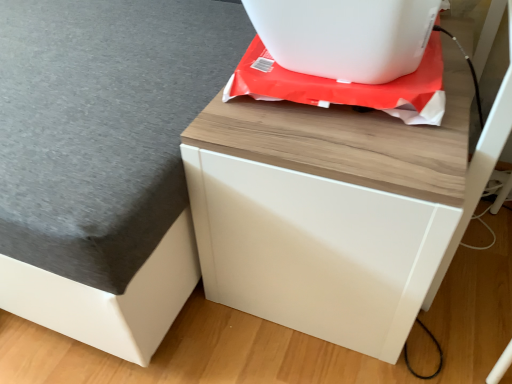
This screenshot has height=384, width=512. What do you see at coordinates (336, 210) in the screenshot? I see `white matte drawer at center` at bounding box center [336, 210].

Find the location of `white matte drawer at center`. white matte drawer at center is located at coordinates (336, 210).

The width and height of the screenshot is (512, 384). What do you see at coordinates (345, 36) in the screenshot? I see `white plastic appliance at upper center` at bounding box center [345, 36].

This screenshot has height=384, width=512. Identify the location of wooden table at upper right. (104, 161).

At what (x,y) coordinates should I click in order to perform the action: click on white matte drawer at center. Please return your answer as a coordinate pair (x, y). The height and width of the screenshot is (384, 512). Looking at the image, I should click on (336, 210).

Identify the location of appliance that appears on the right of wooden table at upper right. This screenshot has width=512, height=384. (345, 36).

In the scene shown: In the image, is white plastic appliance at upper center on the left side or the right side of wooden table at upper right?

From the image, it's evident that white plastic appliance at upper center is to the right of wooden table at upper right.

Is point (318, 2) positioned behind point (156, 330)?

No, (318, 2) is in front of (156, 330).

From the image's perspective, is white plastic appliance at upper center on top of wooden table at upper right?

Yes, from the image's perspective, white plastic appliance at upper center is on top of wooden table at upper right.

Is wooden table at upper right at the right side of white matte drawer at center?

No, wooden table at upper right is not to the right of white matte drawer at center.

From the image's perspective, relative to white matte drawer at center, is wooden table at upper right above or below?

From the image's perspective, wooden table at upper right appears above white matte drawer at center.

Is wooden table at upper right facing away from white matte drawer at center?

No, wooden table at upper right is not facing away from white matte drawer at center.

Where is `furniture on the right of the white plastic appliance at upper center`? This screenshot has width=512, height=384. furniture on the right of the white plastic appliance at upper center is located at coordinates (336, 210).

From the image's perspective, which one is positioned higher, white plastic appliance at upper center or white matte drawer at center?

white plastic appliance at upper center is shown above in the image.

Is white plastic appliance at upper center directly adjacent to white matte drawer at center?

white plastic appliance at upper center and white matte drawer at center are clearly separated.

From the image's perspective, is white matte drawer at center above or below white plastic appliance at upper center?

Based on their image positions, white matte drawer at center is located beneath white plastic appliance at upper center.

Based on the photo, from a real-world perspective, is white matte drawer at center positioned above or below white plastic appliance at upper center?

Clearly, from a real-world perspective, white matte drawer at center is below white plastic appliance at upper center.

Are white matte drawer at center and white plastic appliance at upper center far apart?

No, white matte drawer at center is not far from white plastic appliance at upper center.

Based on the photo, from a real-world perspective, is white matte drawer at center physically below wooden table at upper right?

Indeed, from a real-world perspective, white matte drawer at center is positioned beneath wooden table at upper right.

Is white matte drawer at center oriented towards wooden table at upper right?

No, white matte drawer at center is not facing towards wooden table at upper right.

From the image's perspective, is white matte drawer at center located beneath wooden table at upper right?

Correct, white matte drawer at center appears lower than wooden table at upper right in the image.

The image size is (512, 384). In order to click on table top that is on the left side of white plastic appliance at upper center in this screenshot , I will do `click(104, 161)`.

Can you confirm if wooden table at upper right is taller than white plastic appliance at upper center?

Yes.

From the picture: Is wooden table at upper right positioned behind white plastic appliance at upper center?

No, wooden table at upper right is in front of white plastic appliance at upper center.

You are a GUI agent. You are given a task and a screenshot of the screen. Output one action in this format:
    pyautogui.click(x=<x>, y=<y>)
    Task: Click on the table top lying below the white plastic appliance at upper center (from the image's perspective)
    
    Given the screenshot: What is the action you would take?
    pyautogui.click(x=104, y=161)

Identify the location of table top above the white matte drawer at center (from the image's perspective). This screenshot has width=512, height=384. (104, 161).

Looking at the image, which one is located further to wooden table at upper right, white plastic appliance at upper center or white matte drawer at center?

Among the two, white plastic appliance at upper center is located further to wooden table at upper right.

Considering their positions, is white matte drawer at center positioned further to white plastic appliance at upper center than wooden table at upper right?

wooden table at upper right is further to white plastic appliance at upper center.

Based on their spatial positions, is wooden table at upper right or white plastic appliance at upper center further from white matte drawer at center?

The object further to white matte drawer at center is wooden table at upper right.

Looking at the image, which one is located closer to white matte drawer at center, white plastic appliance at upper center or wooden table at upper right?

Among the two, white plastic appliance at upper center is located nearer to white matte drawer at center.

When comparing their distances from white plastic appliance at upper center, does wooden table at upper right or white matte drawer at center seem closer?

Based on the image, white matte drawer at center appears to be nearer to white plastic appliance at upper center.

From the image, which object appears to be nearer to wooden table at upper right, white matte drawer at center or white plastic appliance at upper center?

white matte drawer at center is closer to wooden table at upper right.

Where is `appliance between wooden table at upper right and white matte drawer at center`? Image resolution: width=512 pixels, height=384 pixels. appliance between wooden table at upper right and white matte drawer at center is located at coordinates (345, 36).